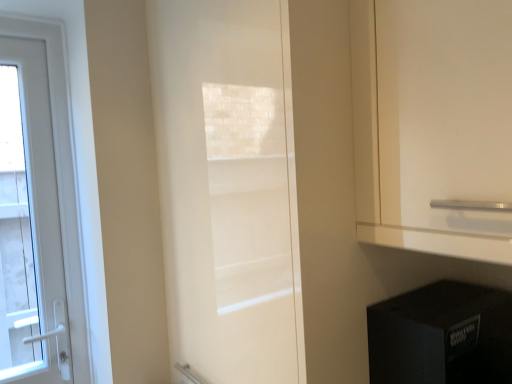
Question: From the image's perspective, is white glossy door at left, placed as the 1th door when sorted from back to front, above or below black plastic speaker at lower right?

Choices:
 (A) below
 (B) above

Answer: (B)

Question: In terms of size, does white glossy door at left, acting as the first door starting from the left, appear bigger or smaller than black plastic speaker at lower right?

Choices:
 (A) small
 (B) big

Answer: (A)

Question: Based on their relative distances, which object is nearer to the white glossy door at center, which is the 1th door in front-to-back order?

Choices:
 (A) black plastic speaker at lower right
 (B) white glossy door at left, arranged as the second door when viewed from the right

Answer: (A)

Question: Which is farther from the black plastic speaker at lower right?

Choices:
 (A) white glossy door at center, the 2th door when ordered from back to front
 (B) white glossy door at left, marked as the second door in a front-to-back arrangement

Answer: (B)